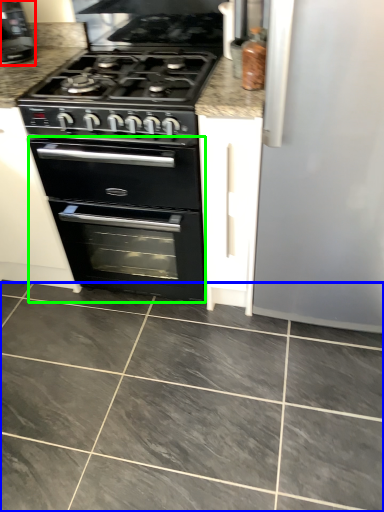
Question: Estimate the real-world distances between objects in this image. Which object is farther from coffee machine (highlighted by a red box), ceramic tile (highlighted by a blue box) or oven (highlighted by a green box)?

Choices:
 (A) ceramic tile
 (B) oven

Answer: (A)